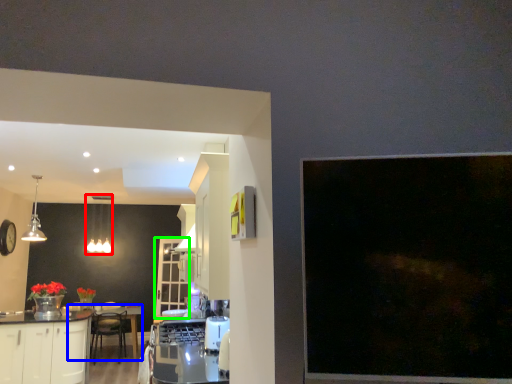
Question: Considering the real-world distances, which object is closest to lighting (highlighted by a red box)? round table (highlighted by a blue box) or glass door (highlighted by a green box).

Choices:
 (A) round table
 (B) glass door

Answer: (B)